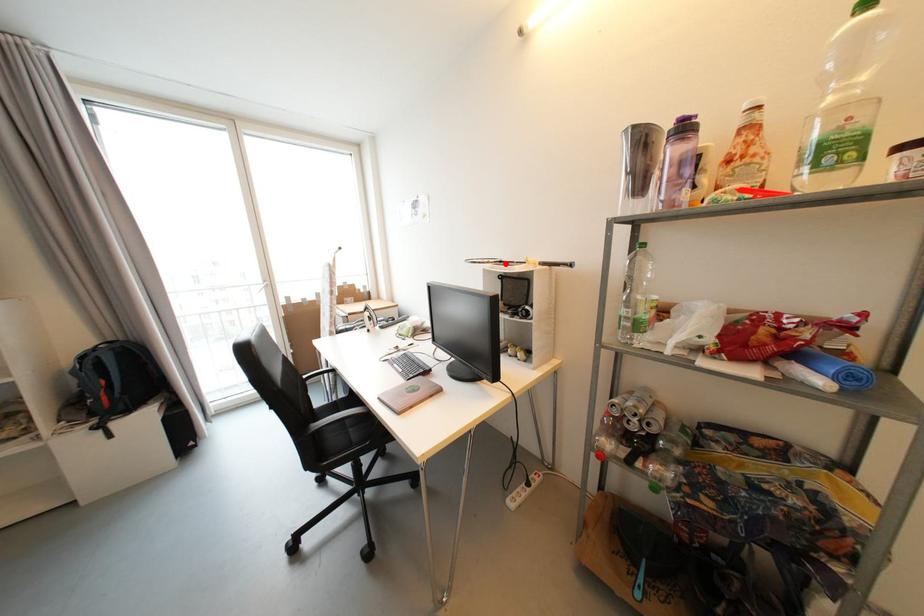
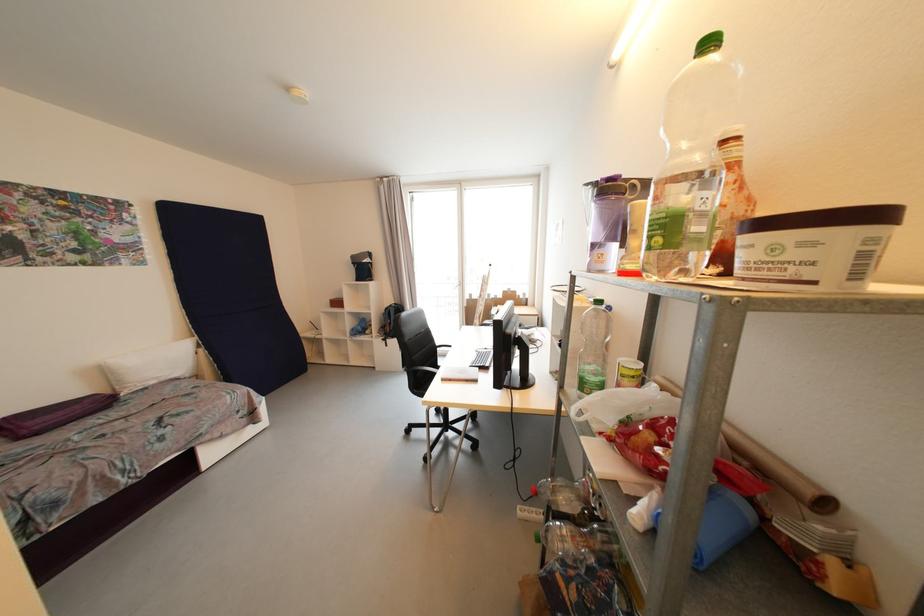
Question: I am providing you with two images of the same scene from different viewpoints. A red point is marked on the first image. Is the red point's position out of view in image 2?

Choices:
 (A) Yes
 (B) No

Answer: (A)